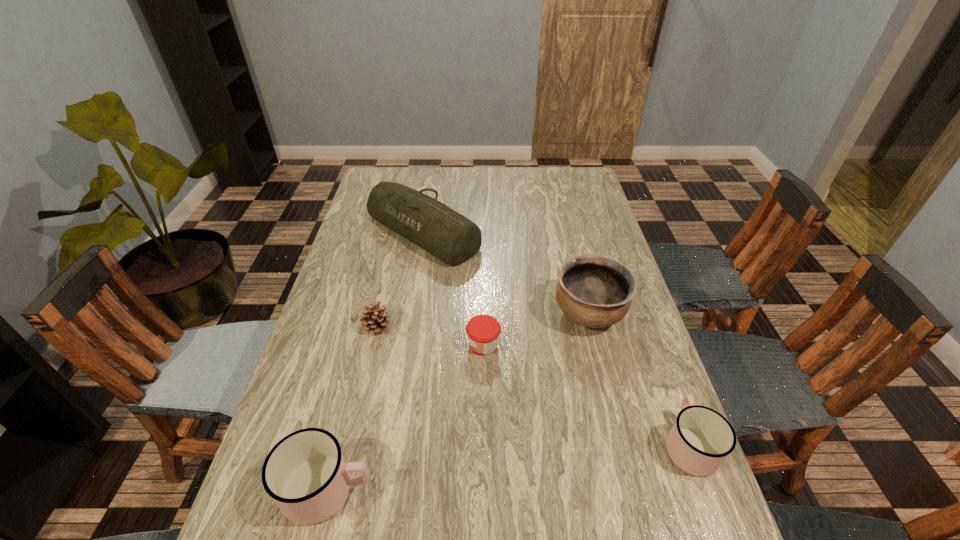
You are a GUI agent. You are given a task and a screenshot of the screen. Output one action in this format:
    pyautogui.click(x=<x>, y=<y>)
    Task: Click on the free space located 0.130m on the side of the right mug with the handle
    The height and width of the screenshot is (540, 960).
    Given the screenshot: What is the action you would take?
    pyautogui.click(x=660, y=368)

This screenshot has height=540, width=960. Find the location of `free region located 0.340m on the label side of the shortest object`. free region located 0.340m on the label side of the shortest object is located at coordinates (339, 345).

Identify the location of free spot located 0.140m on the label side of the shortest object. (414, 345).

Locate an element on the screen. The width and height of the screenshot is (960, 540). free location located on the label side of the shortest object is located at coordinates (327, 345).

The width and height of the screenshot is (960, 540). What are the coordinates of `free space located 0.380m on the back of the pottery` in the screenshot? It's located at (565, 218).

Find the location of `free space located on the left of the farthest object`. free space located on the left of the farthest object is located at coordinates (350, 232).

Where is `free space located 0.160m on the back of the pinecone`? free space located 0.160m on the back of the pinecone is located at coordinates (388, 278).

Locate an element on the screen. The width and height of the screenshot is (960, 540). object at the near edge is located at coordinates (305, 473).

Find the location of a particular element. mug present at the left edge is located at coordinates (305, 473).

This screenshot has height=540, width=960. Identify the location of duffel bag present at the left edge. (446, 234).